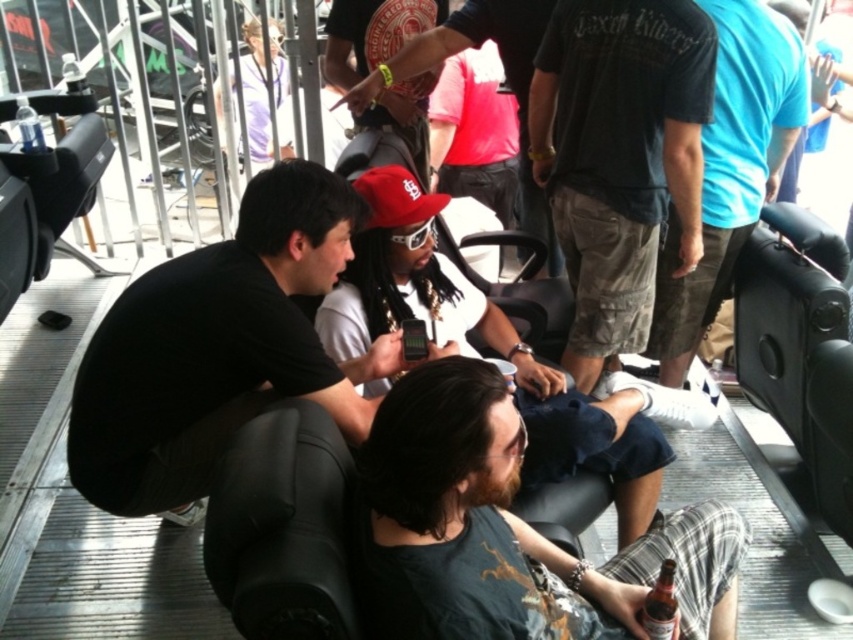
Question: Which point is closer to the camera?

Choices:
 (A) (505, 67)
 (B) (386, 28)
 (C) (715, 556)

Answer: (C)

Question: Does matte white shirt at center appear on the left side of red fabric baseball cap at center?

Choices:
 (A) yes
 (B) no

Answer: (B)

Question: Is matte black cap at center further to camera compared to matte red cap at center?

Choices:
 (A) no
 (B) yes

Answer: (A)

Question: Can you confirm if dark gray t-shirt at center is wider than matte black cap at center?

Choices:
 (A) no
 (B) yes

Answer: (A)

Question: Which of the following is the closest to the observer?

Choices:
 (A) (531, 195)
 (B) (345, 17)
 (C) (598, 419)
 (D) (115, 410)

Answer: (D)

Question: Which point is farther from the camera taking this photo?

Choices:
 (A) [x=679, y=269]
 (B) [x=389, y=10]
 (C) [x=151, y=307]
 (D) [x=505, y=70]

Answer: (D)